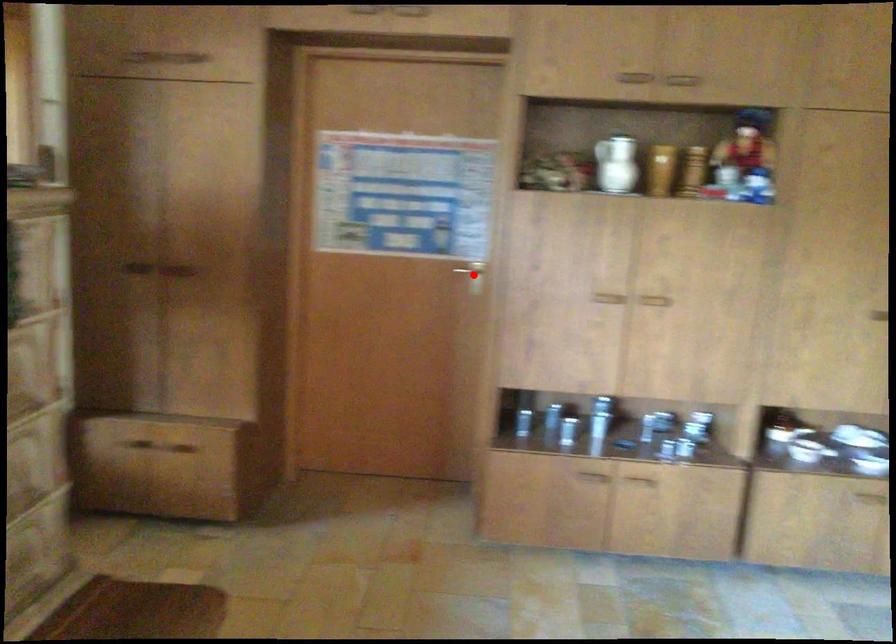
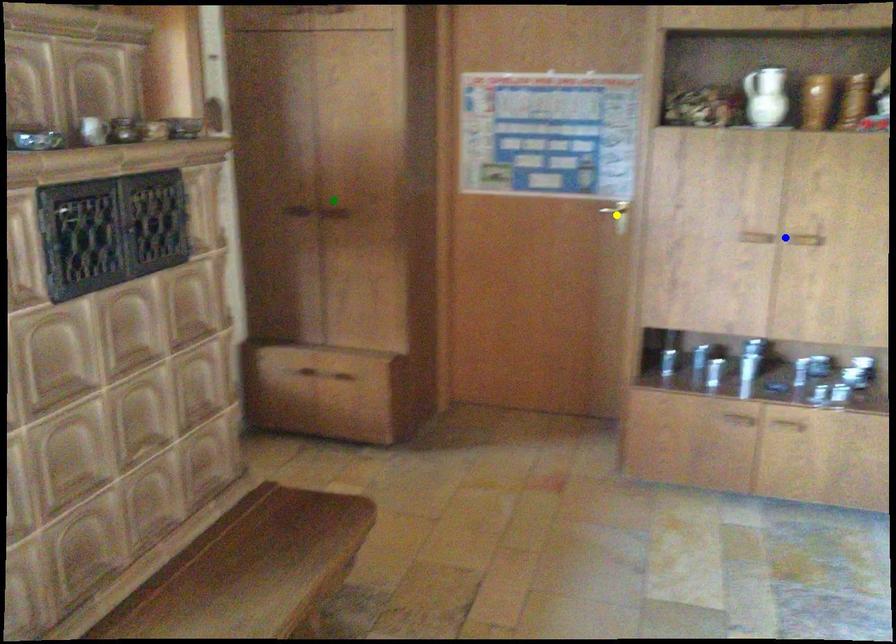
Question: I am providing you with two images of the same scene from different viewpoints. A red point is marked on the first image. You are given multiple points on the second image. Can you choose the point in image 2 that corresponds to the point in image 1?

Choices:
 (A) blue point
 (B) green point
 (C) yellow point

Answer: (C)